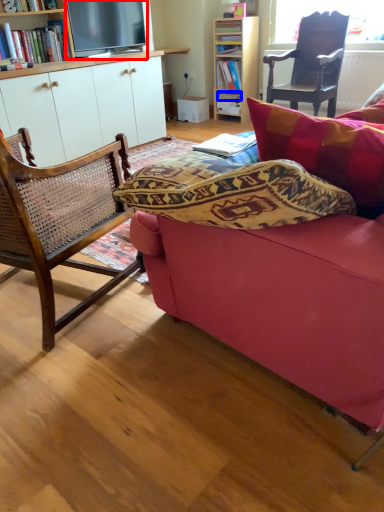
Question: Among these objects, which one is farthest to the camera, television (highlighted by a red box) or book (highlighted by a blue box)?

Choices:
 (A) television
 (B) book

Answer: (B)